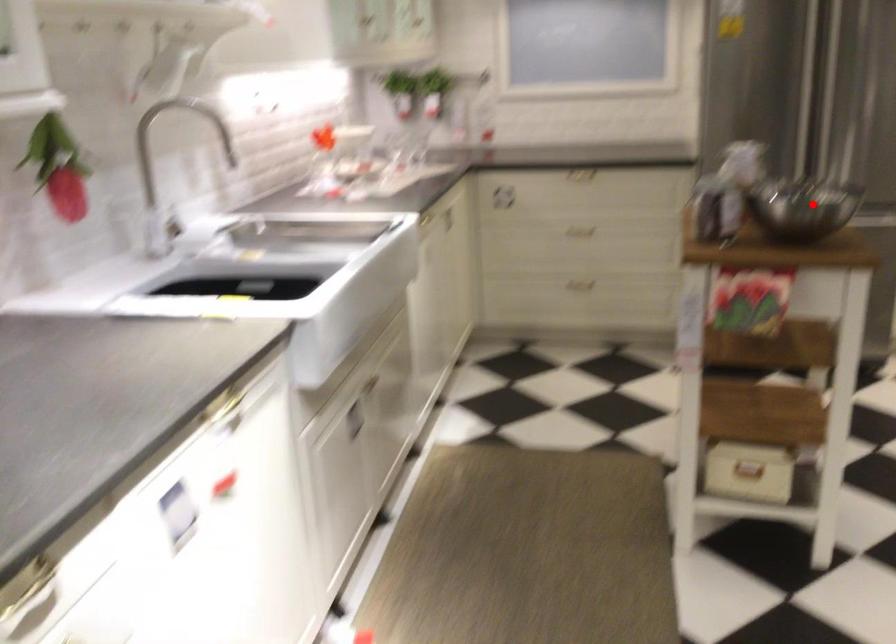
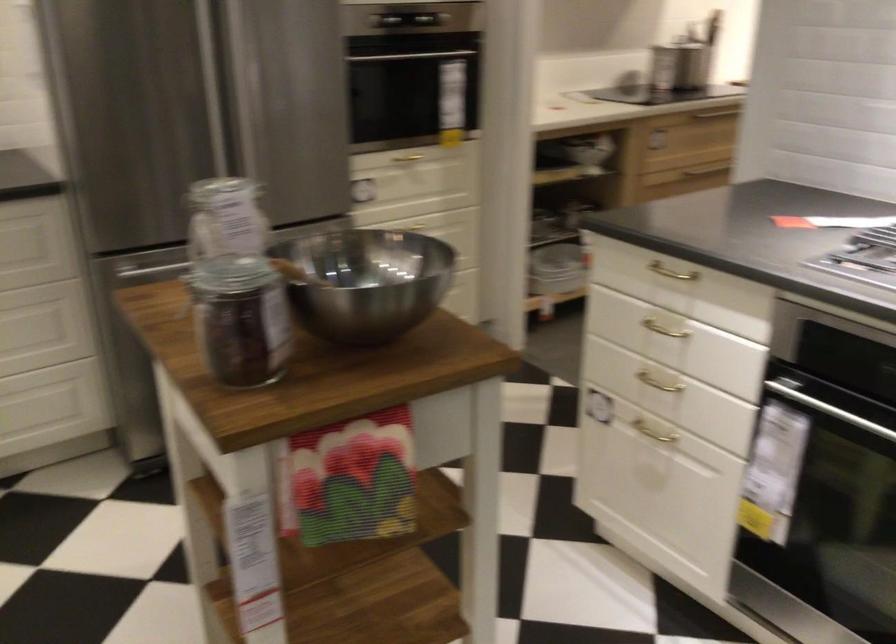
The point at the highlighted location is marked in the first image. Where is the corresponding point in the second image?

(366, 281)